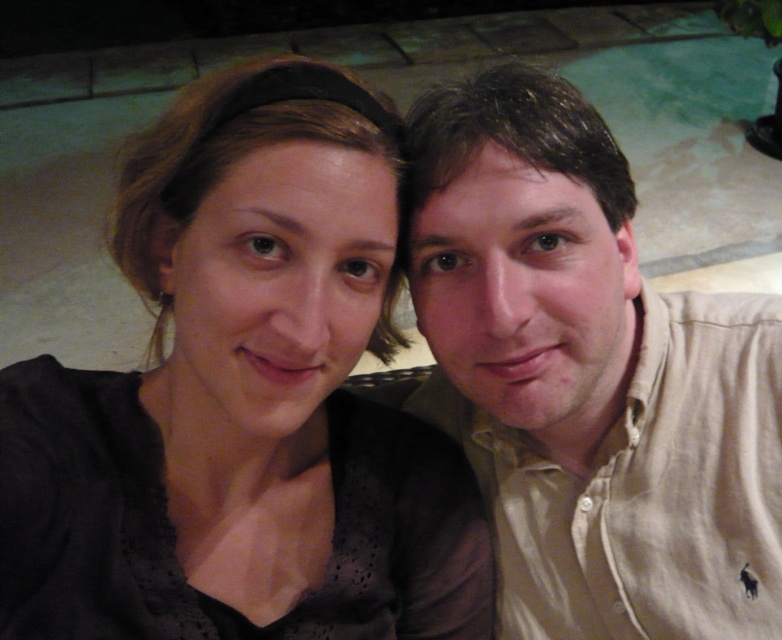
Between matte black top at center and beige cotton shirt at right, which one has more height?

With more height is beige cotton shirt at right.

Does matte black top at center come behind beige cotton shirt at right?

No, it is not.

Which is behind, point (332, 346) or point (569, 625)?

The point (569, 625) is more distant.

Locate an element on the screen. The image size is (782, 640). matte black top at center is located at coordinates (242, 403).